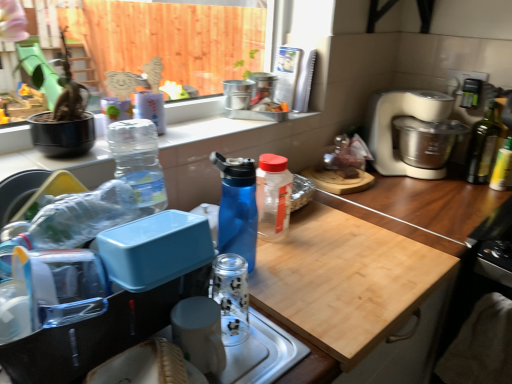
At what (x,y) coordinates should I click in order to perform the action: click on vacant region to the right of transparent plastic bottle at center, which is the third bottle in front-to-back order. Please return your answer as a coordinate pair (x, y). Looking at the image, I should click on (333, 238).